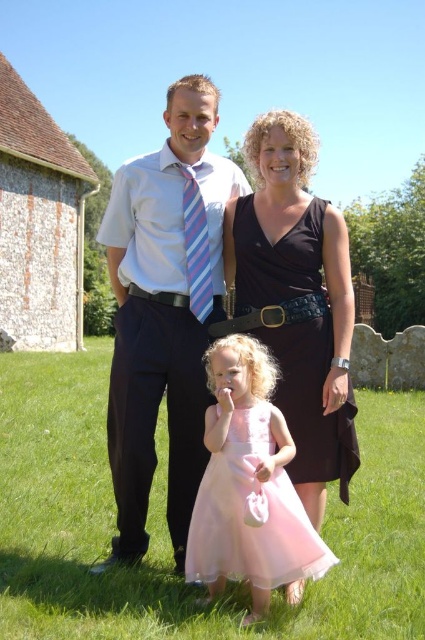
Which of these two, black satin dress at center or striped fabric tie at center, stands shorter?

Standing shorter between the two is striped fabric tie at center.

Between point (303, 150) and point (192, 301), which one is positioned behind?

Positioned behind is point (303, 150).

Locate an element on the screen. Image resolution: width=425 pixels, height=640 pixels. black satin dress at center is located at coordinates (297, 300).

This screenshot has width=425, height=640. In order to click on black satin dress at center in this screenshot , I will do `click(297, 300)`.

Between white shirt at center and striped fabric tie at center, which one is positioned higher?

Positioned higher is striped fabric tie at center.

What do you see at coordinates (164, 310) in the screenshot?
I see `white shirt at center` at bounding box center [164, 310].

Identify the location of white shirt at center. The height and width of the screenshot is (640, 425). (164, 310).

Is green grass at lower center to the left of pink satin dress at center from the viewer's perspective?

In fact, green grass at lower center is to the right of pink satin dress at center.

Is green grass at lower center to the right of pink satin dress at center from the viewer's perspective?

Indeed, green grass at lower center is positioned on the right side of pink satin dress at center.

Identify the location of green grass at lower center. 167,529.

This screenshot has width=425, height=640. Find the location of `green grass at lower center`. green grass at lower center is located at coordinates (167, 529).